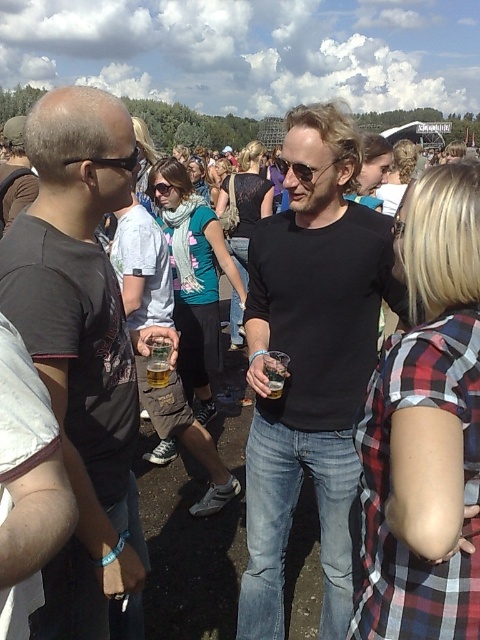
Question: Is black matte shirt at center wider than matte black sunglasses at left?

Choices:
 (A) yes
 (B) no

Answer: (A)

Question: Does translucent glass beer at center have a greater width compared to translucent plastic cup at center?

Choices:
 (A) no
 (B) yes

Answer: (B)

Question: Is the position of matte black t-shirt at left more distant than that of translucent glass beer at center?

Choices:
 (A) yes
 (B) no

Answer: (B)

Question: Which of the following is the farthest from the observer?

Choices:
 (A) (156, 358)
 (B) (156, 368)
 (C) (45, 164)

Answer: (B)

Question: Which point is closer to the camera taking this photo?

Choices:
 (A) click(x=96, y=209)
 (B) click(x=151, y=364)

Answer: (A)

Question: Which is nearer to the black matte shirt at center?

Choices:
 (A) matte black sunglasses at left
 (B) translucent plastic cup at center
 (C) matte black t-shirt at left
 (D) translucent glass beer at center

Answer: (D)